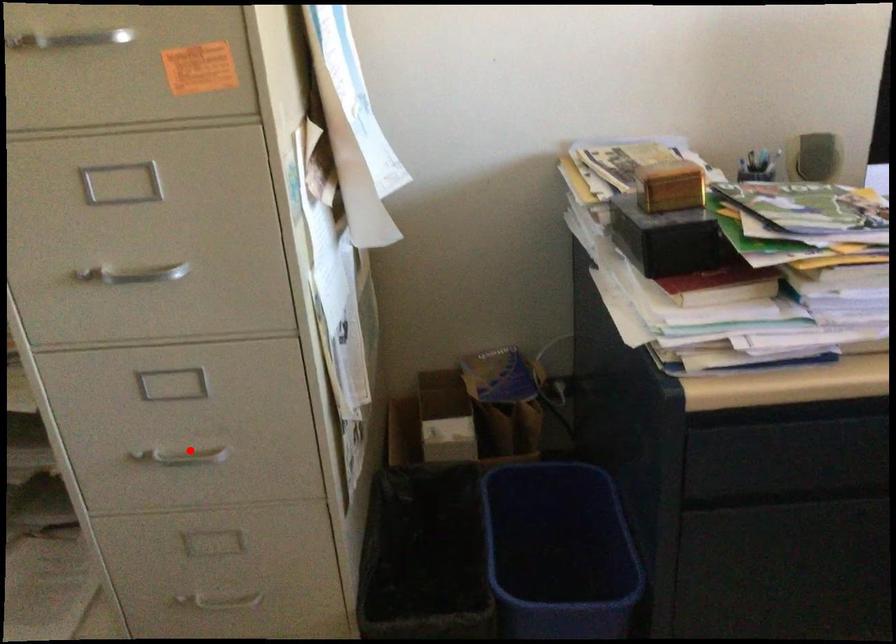
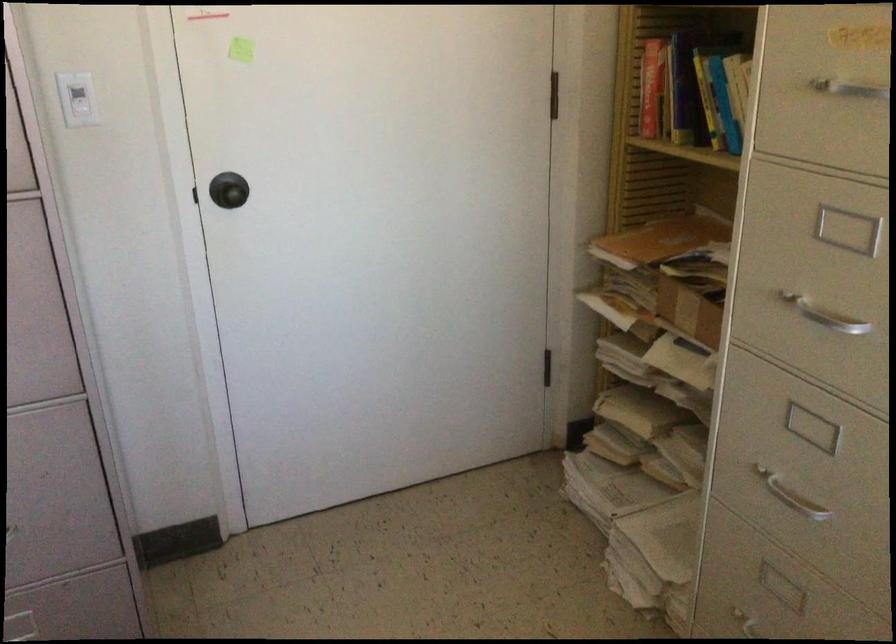
In the second image, find the point that corresponds to the highlighted location in the first image.

(790, 496)